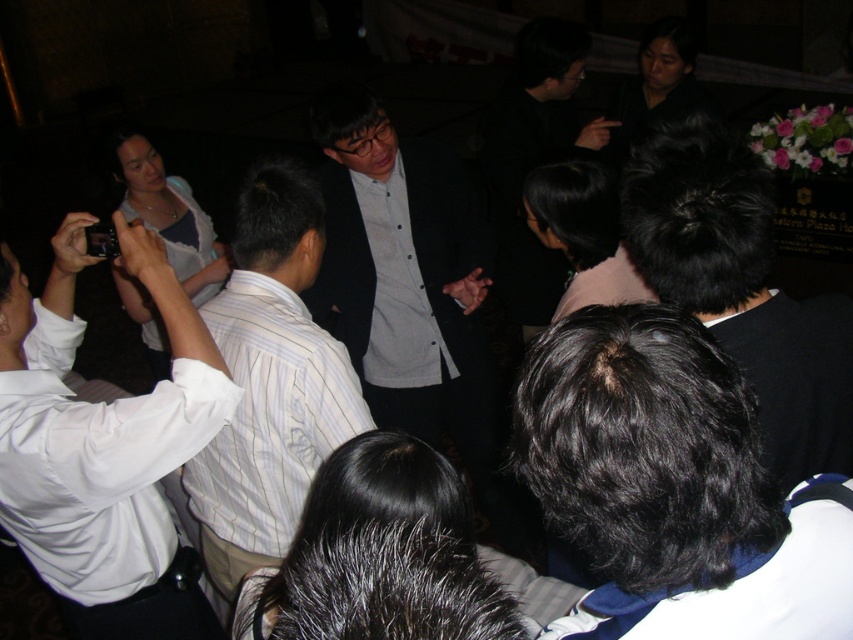
Does dark gray suit at center have a lesser width compared to white striped shirt at center?

Incorrect, dark gray suit at center's width is not less than white striped shirt at center's.

Does dark gray suit at center appear on the right side of white striped shirt at center?

Yes, dark gray suit at center is to the right of white striped shirt at center.

Who is more forward, (x=486, y=410) or (x=257, y=317)?

Positioned in front is point (x=257, y=317).

The height and width of the screenshot is (640, 853). Find the location of `dark gray suit at center`. dark gray suit at center is located at coordinates (403, 269).

Is black hair at center shorter than gray matte shirt at center?

Yes, black hair at center is shorter than gray matte shirt at center.

Is point (680, 209) positioned behind point (409, 292)?

No, it is not.

Between point (746, 368) and point (379, 198), which one is positioned behind?

Positioned behind is point (379, 198).

You are a GUI agent. You are given a task and a screenshot of the screen. Output one action in this format:
    pyautogui.click(x=<x>, y=<y>)
    Task: Click on the black hair at center
    
    Given the screenshot: What is the action you would take?
    pyautogui.click(x=741, y=288)

Between white striped shirt at center and gray matte shirt at center, which one has less height?

Standing shorter between the two is gray matte shirt at center.

Who is more forward, (x=270, y=257) or (x=390, y=337)?

Positioned in front is point (x=270, y=257).

Consider the image. Who is more forward, [347,368] or [396,196]?

Point [347,368] is more forward.

The image size is (853, 640). What are the coordinates of `white striped shirt at center` in the screenshot? It's located at (270, 380).